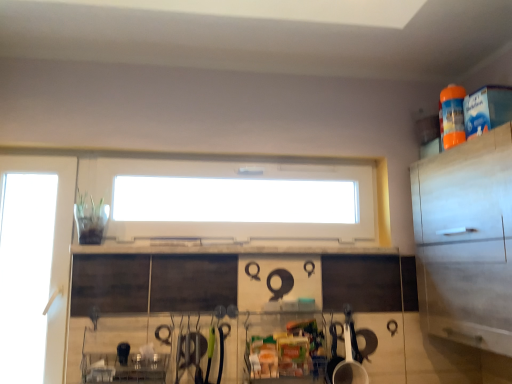
Question: Is white glossy cup at lower center positioned in front of white matte cabinet at right?

Choices:
 (A) no
 (B) yes

Answer: (A)

Question: From the image's perspective, is white glossy cup at lower center beneath white matte cabinet at right?

Choices:
 (A) no
 (B) yes

Answer: (B)

Question: Considering the relative sizes of white glossy cup at lower center and white matte cabinet at right in the image provided, is white glossy cup at lower center bigger than white matte cabinet at right?

Choices:
 (A) no
 (B) yes

Answer: (A)

Question: Could you tell me if white glossy cup at lower center is facing white matte cabinet at right?

Choices:
 (A) no
 (B) yes

Answer: (A)

Question: Considering the relative sizes of white glossy cup at lower center and white matte cabinet at right in the image provided, is white glossy cup at lower center smaller than white matte cabinet at right?

Choices:
 (A) no
 (B) yes

Answer: (B)

Question: Does white glossy cup at lower center have a greater height compared to white matte cabinet at right?

Choices:
 (A) no
 (B) yes

Answer: (A)

Question: Considering the relative sizes of white plastic window at center and transparent glass door at left in the image provided, is white plastic window at center wider than transparent glass door at left?

Choices:
 (A) yes
 (B) no

Answer: (A)

Question: From the image's perspective, would you say white plastic window at center is positioned over transparent glass door at left?

Choices:
 (A) yes
 (B) no

Answer: (A)

Question: Is white plastic window at center turned away from transparent glass door at left?

Choices:
 (A) yes
 (B) no

Answer: (B)

Question: Can you confirm if white plastic window at center is positioned to the left of transparent glass door at left?

Choices:
 (A) yes
 (B) no

Answer: (B)

Question: From a real-world perspective, is white plastic window at center located higher than transparent glass door at left?

Choices:
 (A) yes
 (B) no

Answer: (A)

Question: From a real-world perspective, is white plastic window at center positioned under transparent glass door at left based on gravity?

Choices:
 (A) yes
 (B) no

Answer: (B)

Question: Can you confirm if transparent glass door at left is bigger than white matte cabinet at right?

Choices:
 (A) no
 (B) yes

Answer: (A)